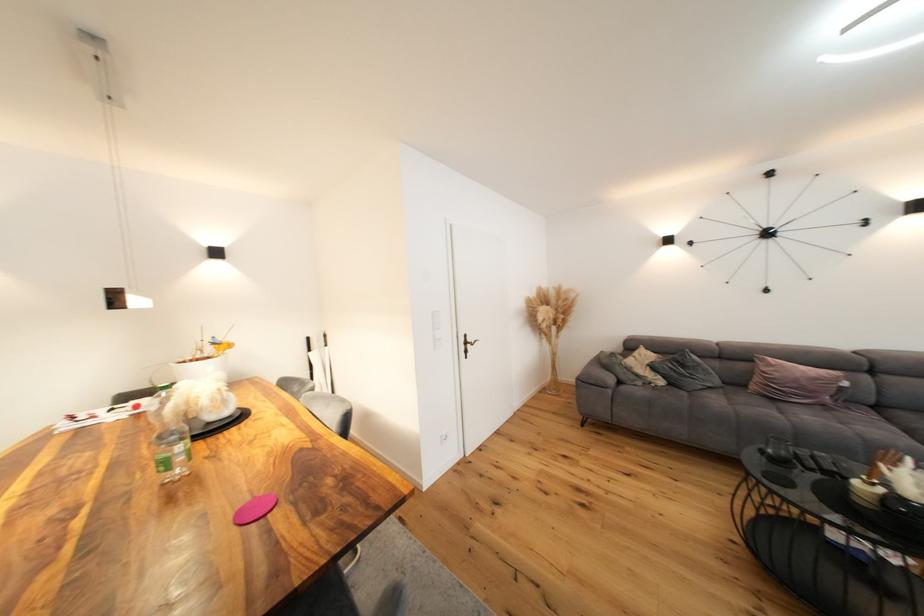
Locate an element on the screen. grey sofa armrest is located at coordinates (597, 378).